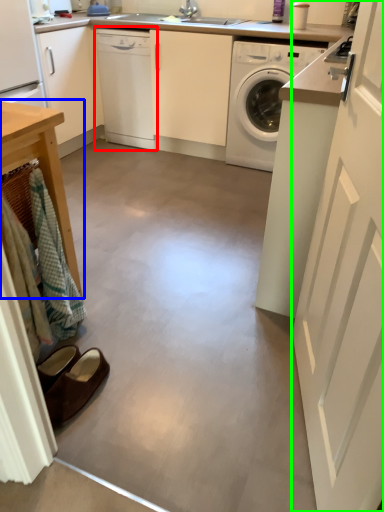
Question: Which is nearer to the dishwasher (highlighted by a red box)? table (highlighted by a blue box) or screen door (highlighted by a green box).

Choices:
 (A) table
 (B) screen door

Answer: (A)